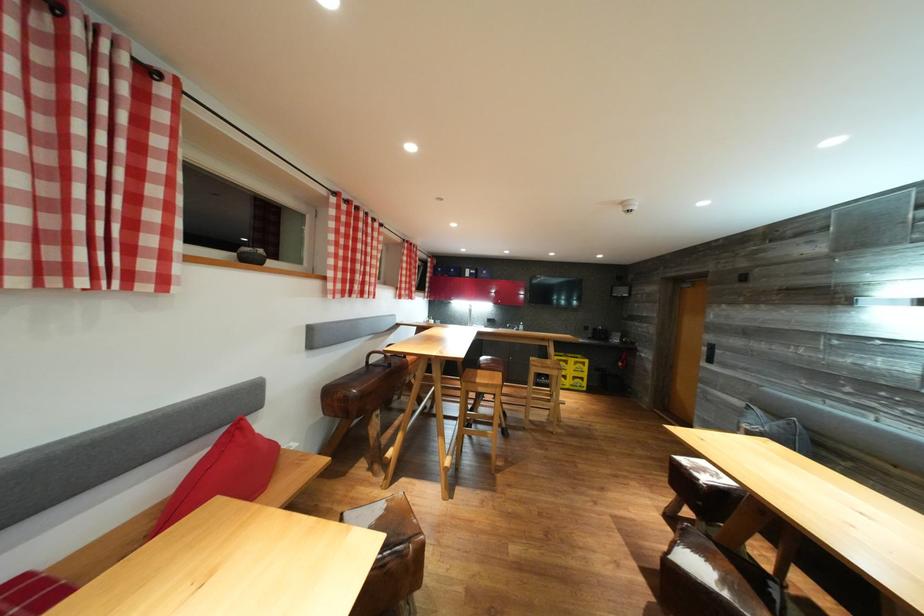
The width and height of the screenshot is (924, 616). Describe the element at coordinates (481, 386) in the screenshot. I see `a wooden stool surface` at that location.